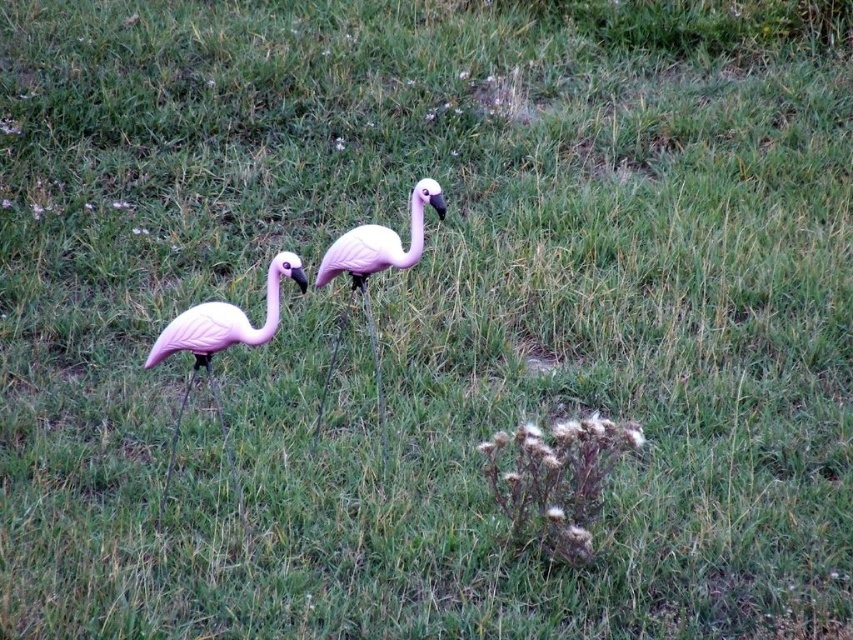
Is point (178, 410) positioned after point (421, 196)?

That is True.

Does point (228, 321) come closer to viewer compared to point (412, 244)?

That is True.

Locate an element on the screen. This screenshot has height=640, width=853. pink matte plastic flamingo at left is located at coordinates (219, 346).